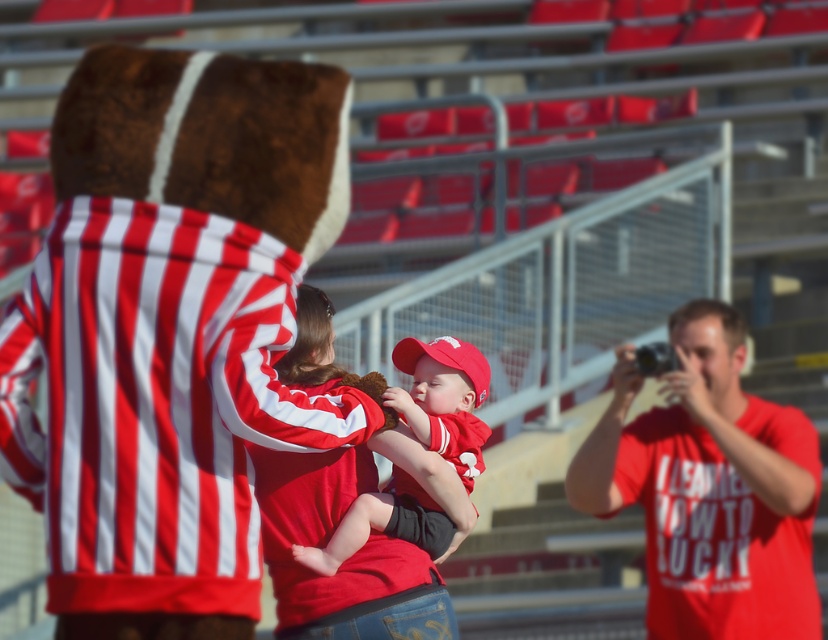
Question: Which of the following is the farthest from the observer?

Choices:
 (A) (663, 552)
 (B) (427, 474)

Answer: (B)

Question: Which point is closer to the camera?

Choices:
 (A) matte red cap at center
 (B) matte red t-shirt at right

Answer: (B)

Question: Is matte red t-shirt at right further to camera compared to matte red cap at center?

Choices:
 (A) no
 (B) yes

Answer: (A)

Question: Which point appears closest to the camera in this image?

Choices:
 (A) (802, 534)
 (B) (354, 545)

Answer: (A)

Question: Does matte red t-shirt at right appear under matte red cap at center?

Choices:
 (A) yes
 (B) no

Answer: (A)

Question: Is matte red t-shirt at right to the left of matte red cap at center from the viewer's perspective?

Choices:
 (A) no
 (B) yes

Answer: (A)